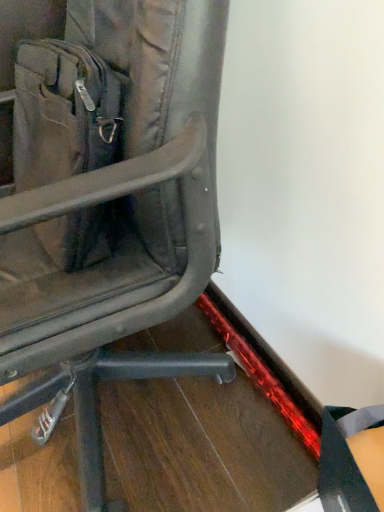
Question: From a real-world perspective, is matte black chair at center positioned over matte black messenger bag at left based on gravity?

Choices:
 (A) yes
 (B) no

Answer: (B)

Question: Is matte black chair at center not inside matte black messenger bag at left?

Choices:
 (A) no
 (B) yes

Answer: (B)

Question: Is matte black chair at center with matte black messenger bag at left?

Choices:
 (A) yes
 (B) no

Answer: (A)

Question: Does matte black chair at center have a lesser width compared to matte black messenger bag at left?

Choices:
 (A) no
 (B) yes

Answer: (A)

Question: Is matte black messenger bag at left located within matte black chair at center?

Choices:
 (A) yes
 (B) no

Answer: (A)

Question: From the image's perspective, is matte black chair at center below matte black messenger bag at left?

Choices:
 (A) no
 (B) yes

Answer: (B)

Question: Does matte black messenger bag at left have a smaller size compared to matte black chair at center?

Choices:
 (A) yes
 (B) no

Answer: (A)

Question: Does matte black messenger bag at left lie in front of matte black chair at center?

Choices:
 (A) yes
 (B) no

Answer: (B)

Question: Is matte black messenger bag at left not within matte black chair at center?

Choices:
 (A) yes
 (B) no

Answer: (B)

Question: Could matte black chair at center be considered to be inside matte black messenger bag at left?

Choices:
 (A) yes
 (B) no

Answer: (B)

Question: Can you confirm if matte black messenger bag at left is positioned to the right of matte black chair at center?

Choices:
 (A) yes
 (B) no

Answer: (B)

Question: Considering the relative sizes of matte black messenger bag at left and matte black chair at center in the image provided, is matte black messenger bag at left bigger than matte black chair at center?

Choices:
 (A) no
 (B) yes

Answer: (A)

Question: Do you think matte black chair at center is within matte black messenger bag at left, or outside of it?

Choices:
 (A) outside
 (B) inside

Answer: (A)